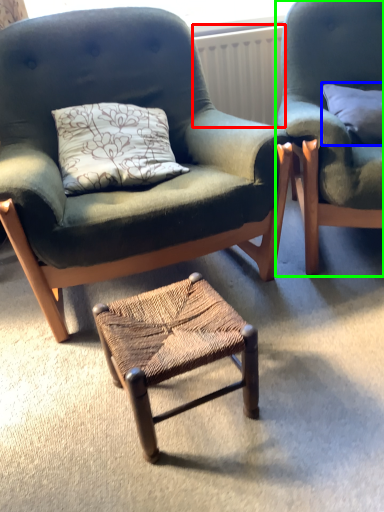
Question: Estimate the real-world distances between objects in this image. Which object is farther from radiator (highlighted by a red box), pillow (highlighted by a blue box) or chair (highlighted by a green box)?

Choices:
 (A) pillow
 (B) chair

Answer: (B)